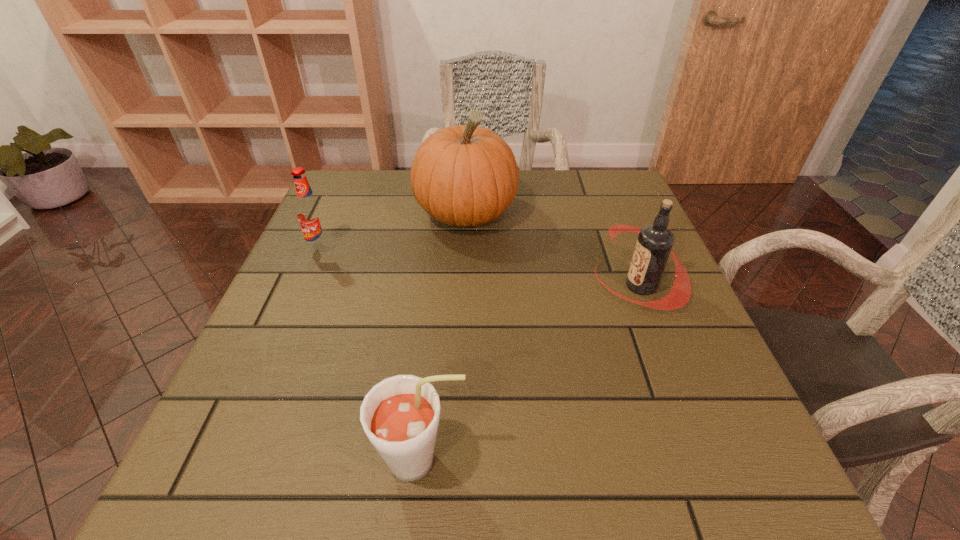
At what (x,y) coordinates should I click in order to perform the action: click on empty location between the tallest object and the leftmost root beer. Please return your answer as a coordinate pair (x, y). This screenshot has width=960, height=540. Looking at the image, I should click on (394, 231).

Locate an element on the screen. The width and height of the screenshot is (960, 540). vacant area that lies between the pumpkin and the nearest object is located at coordinates point(444,337).

Find the location of a particular element. The height and width of the screenshot is (540, 960). free area in between the nearest root beer and the third farthest object is located at coordinates (531, 373).

I want to click on vacant point located between the pumpkin and the farthest root beer, so click(394, 231).

This screenshot has width=960, height=540. Identify the location of the third closest object relative to the pumpkin. (400, 415).

Select which object appears as the third closest to the farthest root beer. Please provide its 2D coordinates. Your answer should be formatted as a tuple, i.e. [(x, y)], where the tuple contains the x and y coordinates of a point satisfying the conditions above.

[(654, 244)]

Find the location of `root beer that stands as the second closest to the rightmost object`. root beer that stands as the second closest to the rightmost object is located at coordinates (310, 214).

Choose which root beer is the third nearest neighbor to the pumpkin. Please provide its 2D coordinates. Your answer should be formatted as a tuple, i.e. [(x, y)], where the tuple contains the x and y coordinates of a point satisfying the conditions above.

[(400, 415)]